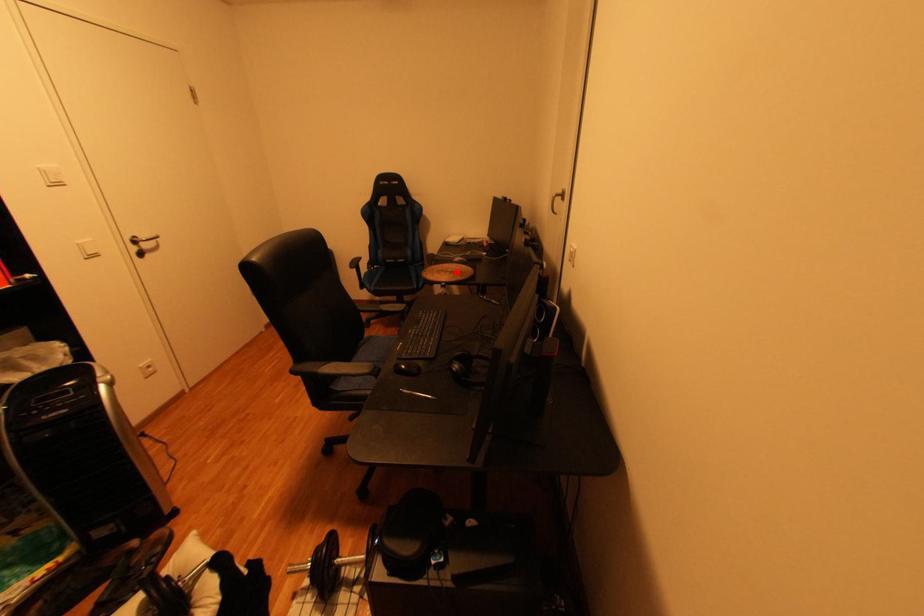
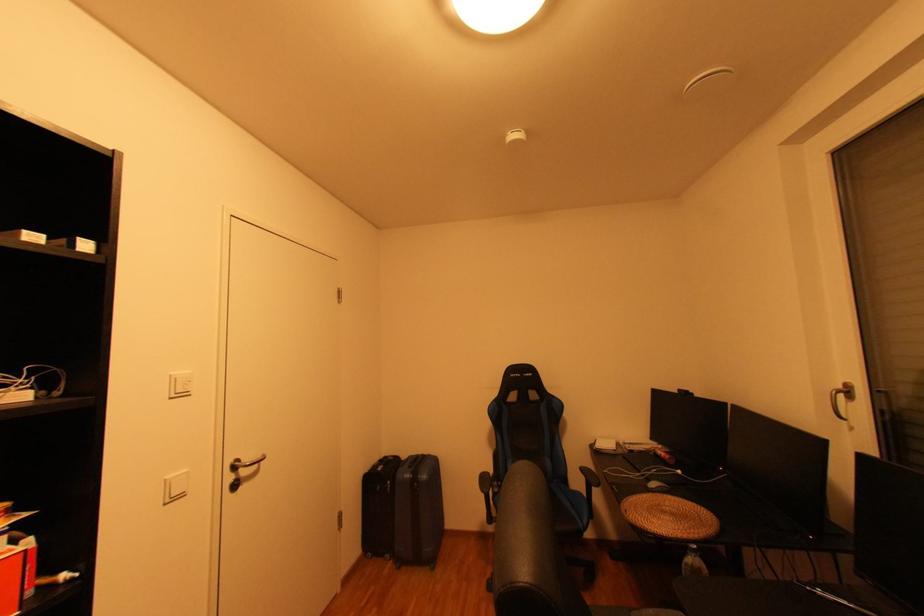
Find the pixel in the second image that matches the highlighted location in the first image.

(674, 513)